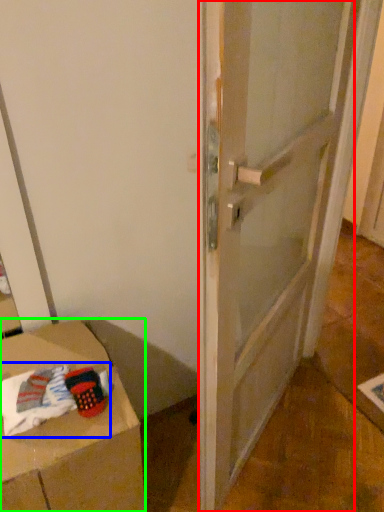
Question: Estimate the real-world distances between objects in this image. Which object is farther from door (highlighted by a red box), laundry (highlighted by a blue box) or furniture (highlighted by a green box)?

Choices:
 (A) laundry
 (B) furniture

Answer: (A)